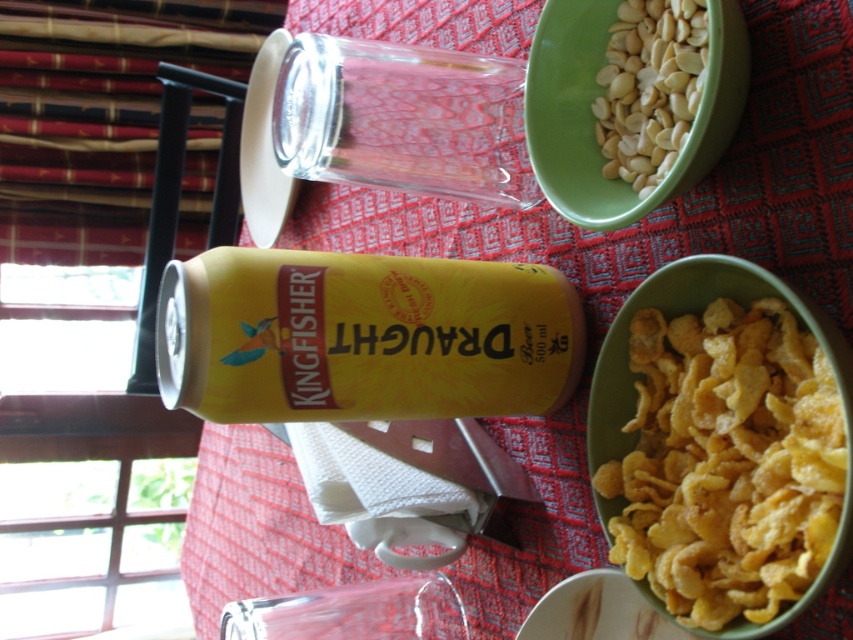
Based on the photo, you are a robot with a 6.5 inch wide arm. You need to pick up the yellow crispy cereal at lower right and place it into the green plastic bowl at upper right. Can your arm fit between them without touching either object?

The distance between the yellow crispy cereal at lower right and the green plastic bowl at upper right is 7.24 inches. Since your arm is 6.5 inches wide, it can fit through the space between them without touching either object.

You are a chef preparing a dish and need to place both the yellow crispy cereal at lower right and the green plastic bowl at upper right on a shelf. The shelf has a height limit of 10 cm. Can both items fit vertically on the shelf without exceeding the height limit?

The yellow crispy cereal at lower right is taller than the green plastic bowl at upper right. Since the cereal is taller, if the cereal exceeds 10 cm, then both cannot fit. However, without specific measurements, we can only confirm that the cereal is taller, but cannot determine if both fit within the 10 cm limit based on the given information.

You are planning to pour the yellow crispy cereal at lower right into the green plastic bowl at upper right. Will the cereal fit inside the bowl?

The yellow crispy cereal at lower right is narrower than the green plastic bowl at upper right, so the cereal will fit inside the bowl.